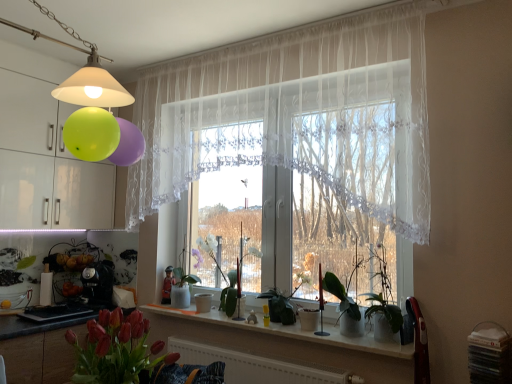
I want to click on empty space that is ontop of white matte radiator at lower center (from a real-world perspective), so click(247, 344).